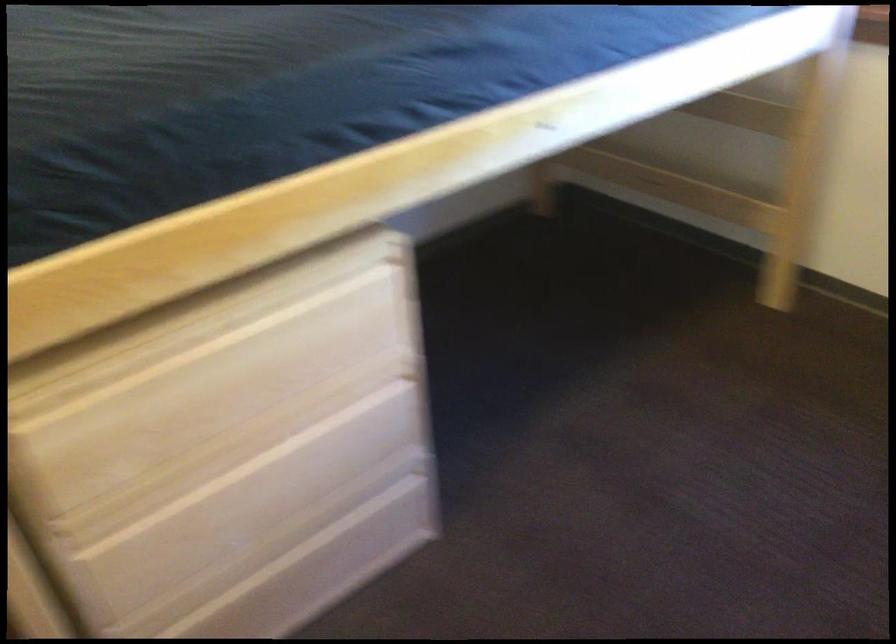
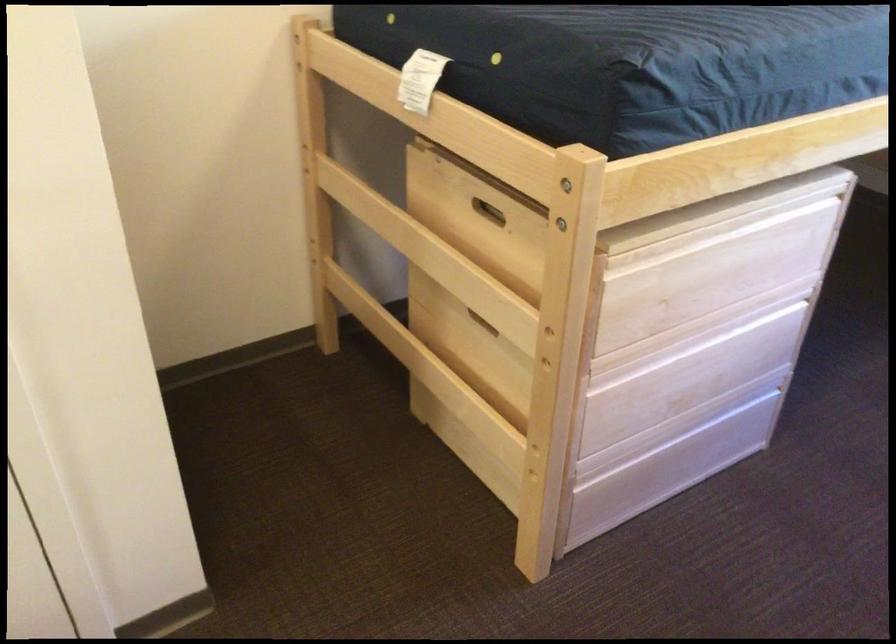
Question: The images are taken continuously from a first-person perspective. In which direction is your viewpoint rotating?

Choices:
 (A) Left
 (B) Right
 (C) Up
 (D) Down

Answer: (A)